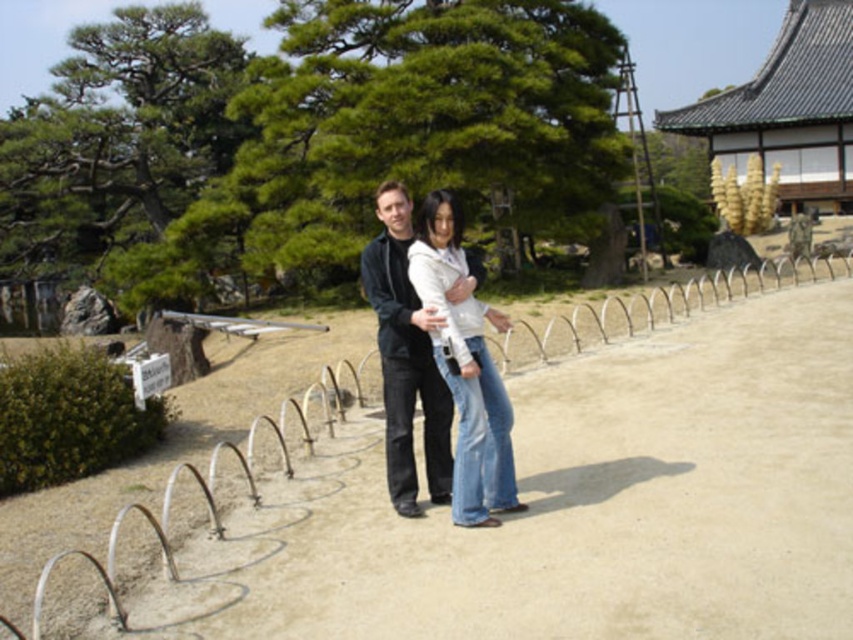
Question: Does silver wire fence at center lie behind dark gray sweater at center?

Choices:
 (A) no
 (B) yes

Answer: (A)

Question: Which of the following is the closest to the observer?

Choices:
 (A) white matte jacket at center
 (B) silver wire fence at center
 (C) dark gray sweater at center

Answer: (B)

Question: Which is nearer to the silver wire fence at center?

Choices:
 (A) dark gray sweater at center
 (B) white matte jacket at center

Answer: (B)

Question: Can you confirm if white matte jacket at center is positioned below dark gray sweater at center?

Choices:
 (A) yes
 (B) no

Answer: (A)

Question: Among these objects, which one is farthest from the camera?

Choices:
 (A) silver wire fence at center
 (B) dark gray sweater at center

Answer: (B)

Question: Does silver wire fence at center appear on the left side of white matte jacket at center?

Choices:
 (A) yes
 (B) no

Answer: (B)